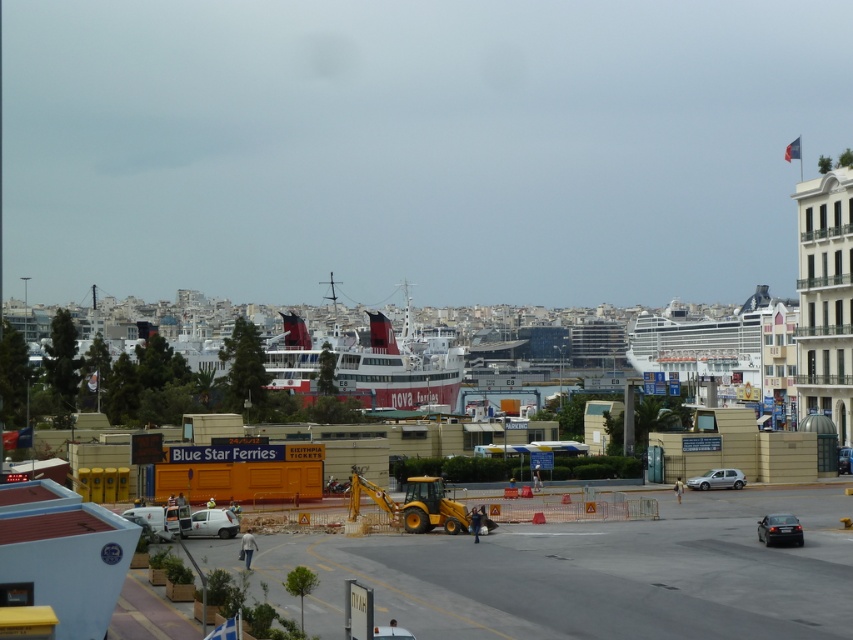
You are standing at the waterfront and want to take a photo of the white glossy cruise ship at center. Your camera has a maximum zoom range of 300 feet. Can you capture the ship clearly without moving closer?

The white glossy cruise ship at center is 511.51 feet away from the viewer. Since the camera can only zoom up to 300 feet, you cannot capture the ship clearly without moving closer.

You are standing at the construction site in the foreground of the waterfront scene. You want to locate the white glossy cruise ship at center. According to the coordinates provided, where exactly would you find the point at (712,342) in relation to the cruise ship?

The point at (712,342) is located on the white glossy cruise ship at center, meaning it is part of the ship itself.